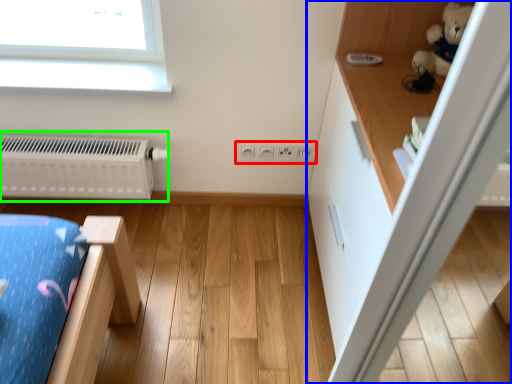
Question: Which is farther away from electric outlet (highlighted by a red box)? dresser (highlighted by a blue box) or radiator (highlighted by a green box)?

Choices:
 (A) dresser
 (B) radiator

Answer: (B)